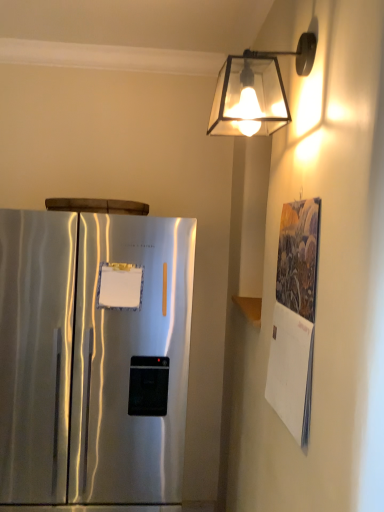
Question: Considering the relative positions of translucent glass lampshade at upper right and textured paper calendar at right in the image provided, is translucent glass lampshade at upper right to the right of textured paper calendar at right from the viewer's perspective?

Choices:
 (A) no
 (B) yes

Answer: (A)

Question: Considering the relative sizes of translucent glass lampshade at upper right and textured paper calendar at right in the image provided, is translucent glass lampshade at upper right smaller than textured paper calendar at right?

Choices:
 (A) yes
 (B) no

Answer: (B)

Question: Can you confirm if translucent glass lampshade at upper right is positioned to the left of textured paper calendar at right?

Choices:
 (A) yes
 (B) no

Answer: (A)

Question: Is textured paper calendar at right located within translucent glass lampshade at upper right?

Choices:
 (A) yes
 (B) no

Answer: (B)

Question: From the image's perspective, would you say translucent glass lampshade at upper right is shown under textured paper calendar at right?

Choices:
 (A) yes
 (B) no

Answer: (B)

Question: Is translucent glass lampshade at upper right thinner than textured paper calendar at right?

Choices:
 (A) no
 (B) yes

Answer: (A)

Question: From a real-world perspective, is satin silver refrigerator at left over translucent glass lampshade at upper right?

Choices:
 (A) yes
 (B) no

Answer: (B)

Question: From the image's perspective, is satin silver refrigerator at left over translucent glass lampshade at upper right?

Choices:
 (A) no
 (B) yes

Answer: (A)

Question: Is there a large distance between satin silver refrigerator at left and translucent glass lampshade at upper right?

Choices:
 (A) no
 (B) yes

Answer: (A)

Question: Is satin silver refrigerator at left aimed at translucent glass lampshade at upper right?

Choices:
 (A) yes
 (B) no

Answer: (B)

Question: Is satin silver refrigerator at left at the right side of translucent glass lampshade at upper right?

Choices:
 (A) no
 (B) yes

Answer: (A)

Question: From the image's perspective, is satin silver refrigerator at left beneath translucent glass lampshade at upper right?

Choices:
 (A) no
 (B) yes

Answer: (B)

Question: Is translucent glass lampshade at upper right oriented towards satin silver refrigerator at left?

Choices:
 (A) no
 (B) yes

Answer: (A)